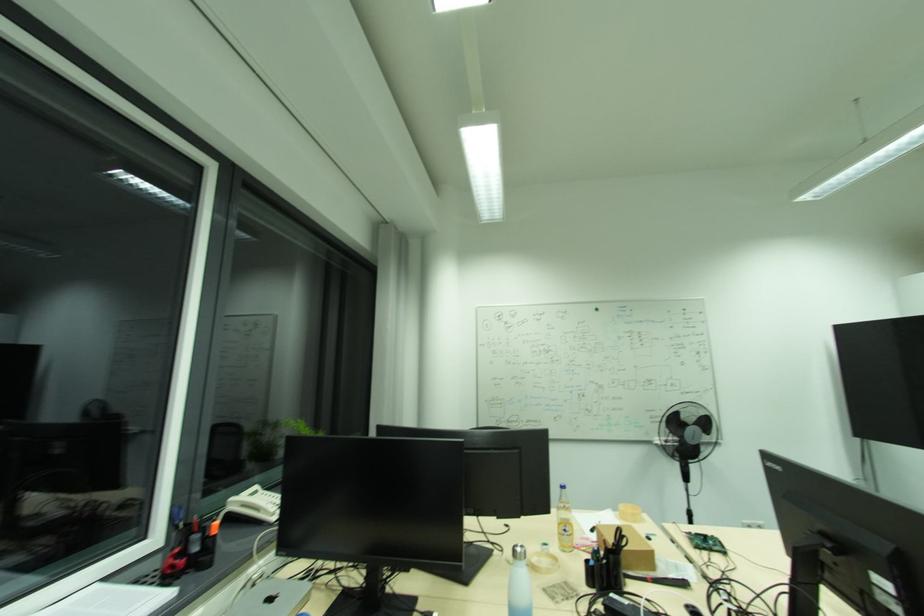
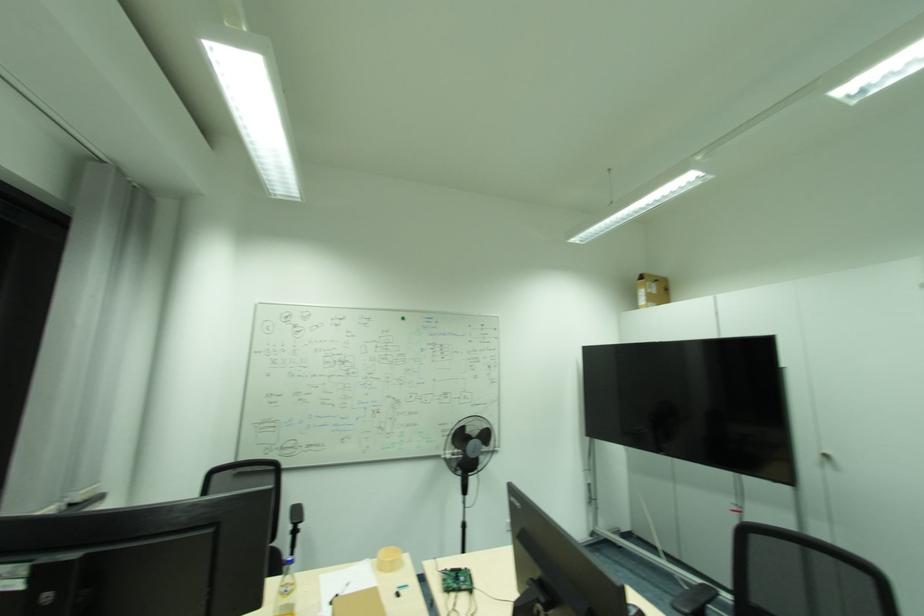
Find the pixel in the second image that matches point 626,507 in the first image.

(386, 553)